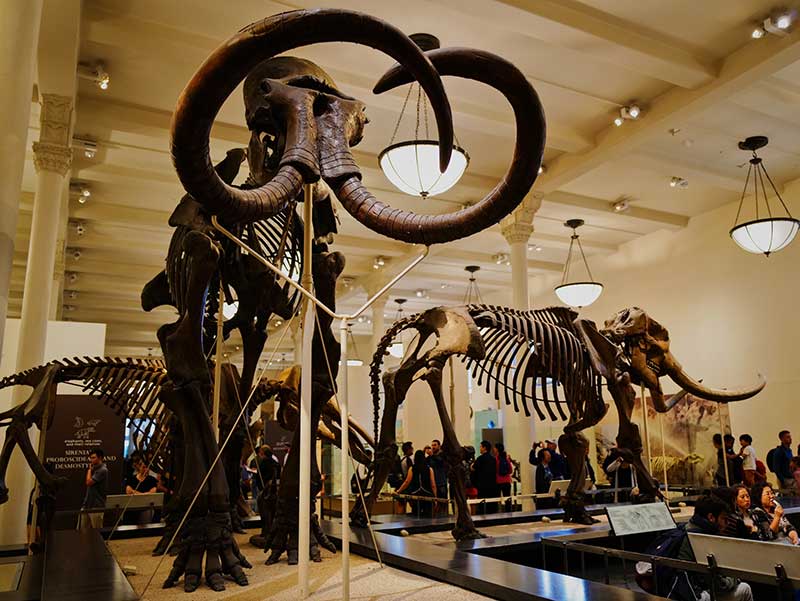
Where is `ceiling lamps`? The image size is (800, 601). ceiling lamps is located at coordinates (422, 175), (582, 297), (772, 232).